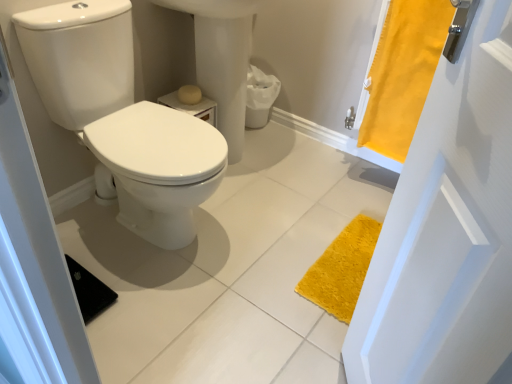
This screenshot has width=512, height=384. I want to click on vacant area that is situated to the right of white glossy toilet at left, so click(278, 236).